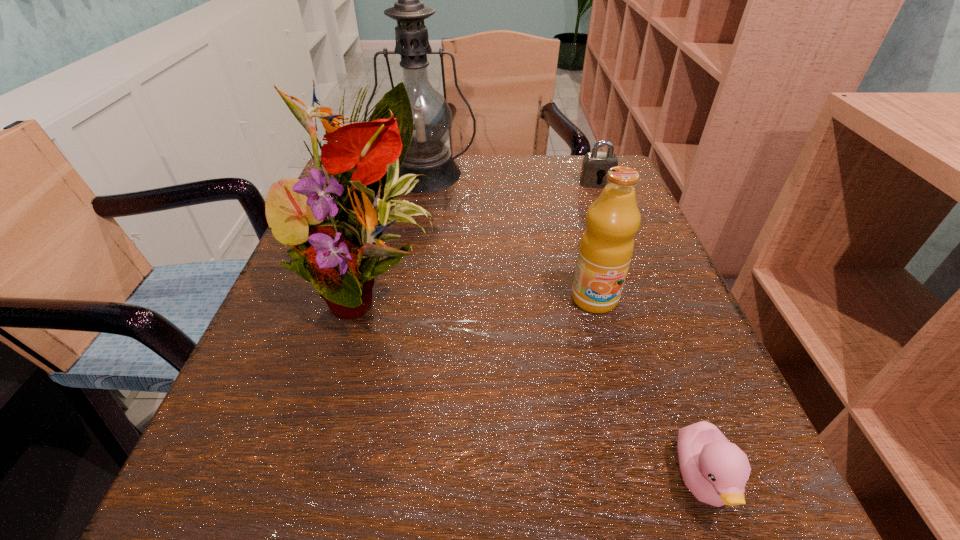
The width and height of the screenshot is (960, 540). In order to click on oil lamp present at the far edge in this screenshot , I will do `click(428, 154)`.

I want to click on padlock present at the far edge, so click(595, 165).

Where is `object that is at the near edge`? This screenshot has height=540, width=960. object that is at the near edge is located at coordinates (715, 470).

The width and height of the screenshot is (960, 540). In order to click on oil lamp that is at the left edge in this screenshot , I will do `click(428, 154)`.

Image resolution: width=960 pixels, height=540 pixels. What are the coordinates of `bouquet at the left edge` in the screenshot? It's located at (333, 254).

Identify the location of fruit juice located at the right edge. Image resolution: width=960 pixels, height=540 pixels. (607, 244).

Identify the location of padlock located at the right edge. The width and height of the screenshot is (960, 540). (595, 165).

Find the location of a particular element. This screenshot has width=960, height=540. duckling positioned at the right edge is located at coordinates (715, 470).

This screenshot has width=960, height=540. I want to click on object positioned at the far left corner, so click(x=428, y=154).

This screenshot has height=540, width=960. What are the coordinates of `object that is at the far right corner` in the screenshot? It's located at (595, 165).